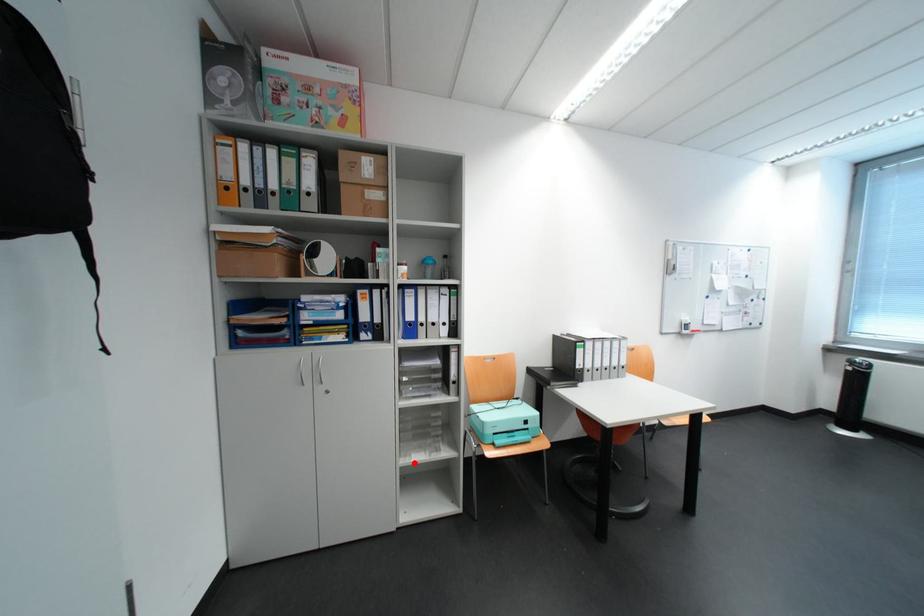
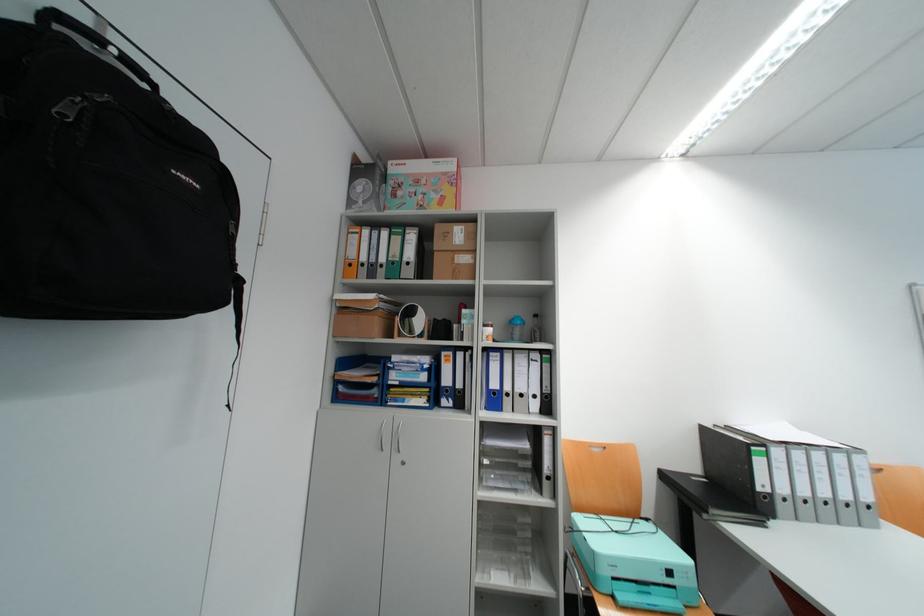
Question: I am providing you with two images of the same scene from different viewpoints. In image1, a red point is highlighted. Considering the same 3D point in image2, which of the following is correct?

Choices:
 (A) It is closer
 (B) It is farther

Answer: (A)